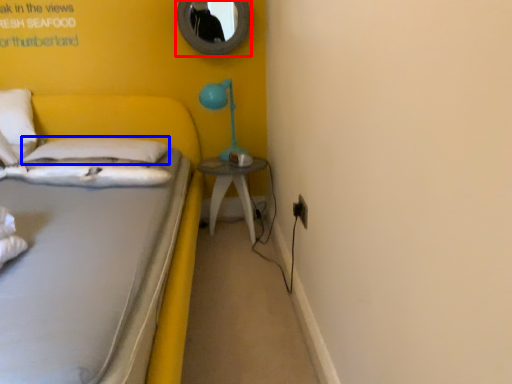
Question: Which object appears farthest to the camera in this image, mirror (highlighted by a red box) or pillow (highlighted by a blue box)?

Choices:
 (A) mirror
 (B) pillow

Answer: (A)